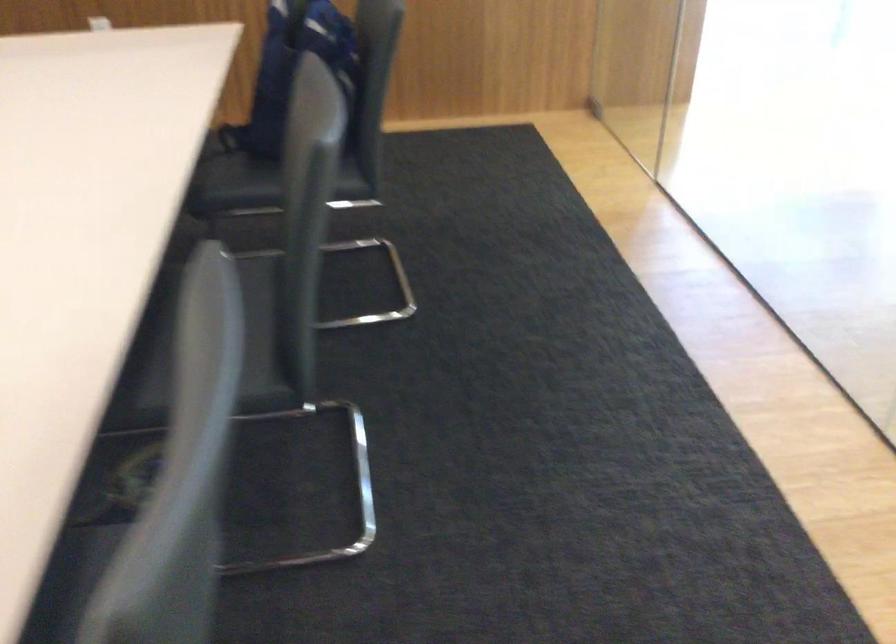
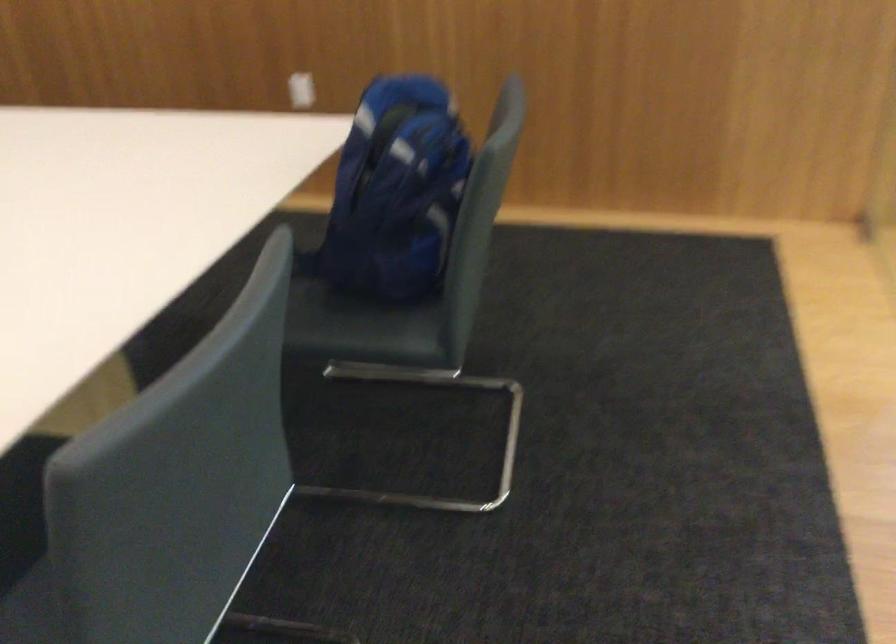
Question: The camera is either moving clockwise (left) or counter-clockwise (right) around the object. The first image is from the beginning of the video and the second image is from the end. Is the camera moving left or right when shooting the video?

Choices:
 (A) Left
 (B) Right

Answer: (B)